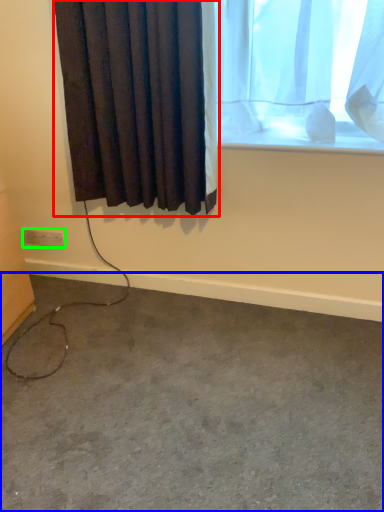
Question: Based on their relative distances, which object is farther from curtain (highlighted by a red box)? Choose from concrete (highlighted by a blue box) and electric outlet (highlighted by a green box).

Choices:
 (A) concrete
 (B) electric outlet

Answer: (A)